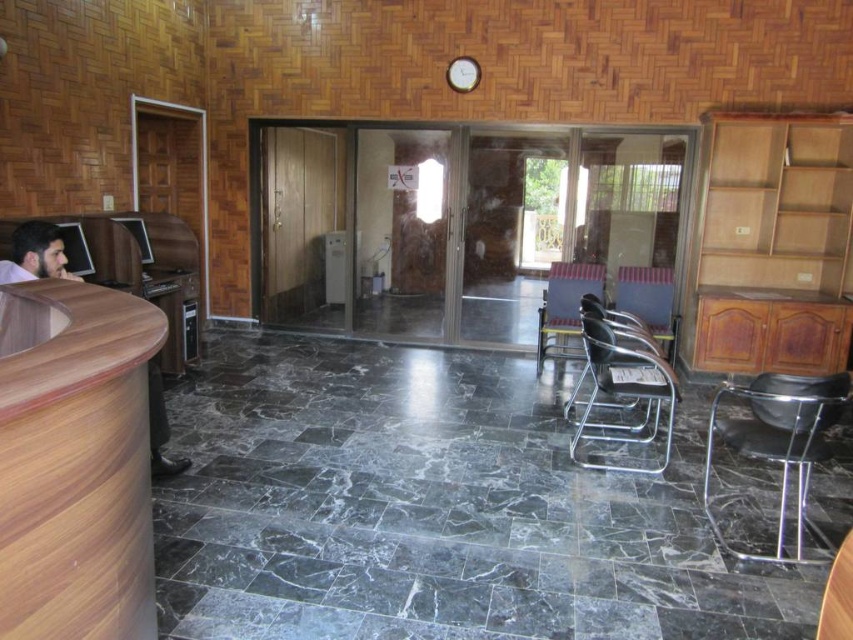
Question: Which of the following is the farthest from the observer?

Choices:
 (A) metallic gray chair at center
 (B) wooden reception desk at left
 (C) brown wood desk at left
 (D) metallic black chair at lower right

Answer: (A)

Question: Can you confirm if metallic black chair at lower right is smaller than brown wood desk at left?

Choices:
 (A) yes
 (B) no

Answer: (B)

Question: In this image, where is wooden reception desk at left located relative to brown wood desk at left?

Choices:
 (A) below
 (B) above

Answer: (A)

Question: Considering the real-world distances, which object is farthest from the metallic black chair at lower right?

Choices:
 (A) brown wood desk at left
 (B) metallic gray chair at center

Answer: (A)

Question: Among these points, which one is nearest to the camera?

Choices:
 (A) (25, 620)
 (B) (618, 384)

Answer: (A)

Question: Is wooden reception desk at left smaller than metallic gray chair at center?

Choices:
 (A) yes
 (B) no

Answer: (A)